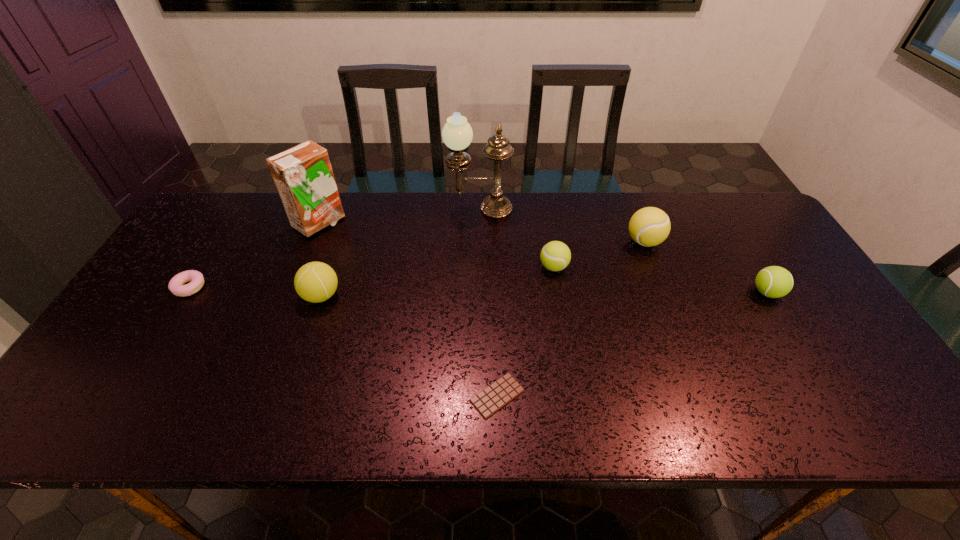
Where is `the tallest object`? the tallest object is located at coordinates (457, 134).

Image resolution: width=960 pixels, height=540 pixels. I want to click on the second tallest object, so click(303, 176).

Find the location of `the second tennis ball from right to left`. the second tennis ball from right to left is located at coordinates (649, 226).

The image size is (960, 540). Identify the location of the farthest tennis ball. (649, 226).

This screenshot has width=960, height=540. What are the coordinates of `the leftmost tennis ball` in the screenshot? It's located at (315, 282).

Where is `the second tennis ball from left to right`? This screenshot has height=540, width=960. the second tennis ball from left to right is located at coordinates (555, 256).

I want to click on the second farthest tennis ball, so click(555, 256).

Locate an element on the screen. This screenshot has width=960, height=540. the rightmost tennis ball is located at coordinates (773, 281).

Find the location of a particular element. Image resolution: width=960 pixels, height=540 pixels. the seventh tallest object is located at coordinates (176, 286).

Where is `doughnut`? The image size is (960, 540). doughnut is located at coordinates (176, 286).